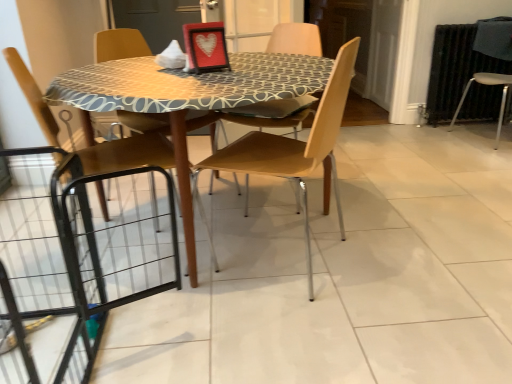
This screenshot has width=512, height=384. What are the coordinates of `wooden chair at center, the second chair positioned from the left` in the screenshot? It's located at (293, 149).

In order to face light brown wood chair at center, the 1th chair when ordered from right to left, should I rotate leftwards or rightwards?

Rotate right and turn 2.709 degrees.

What are the coordinates of `light brown wood chair at center, the 1th chair when ordered from right to left` in the screenshot? It's located at (295, 39).

You are a GUI agent. You are given a task and a screenshot of the screen. Output one action in this format:
    pyautogui.click(x=<x>, y=<y>)
    Task: Click on the matte black picture frame at center
    
    Given the screenshot: What is the action you would take?
    pyautogui.click(x=205, y=47)

From a real-world perspective, is light brown wood chair at center, which is the third chair in left-to-right order, positioned over wooden chair at center, the 2th chair positioned from the right, based on gravity?

Actually, light brown wood chair at center, which is the third chair in left-to-right order, is physically below wooden chair at center, the 2th chair positioned from the right, in the real world.

Does light brown wood chair at center, which is the third chair in left-to-right order, have a greater height compared to wooden chair at center, the 2th chair positioned from the right?

In fact, light brown wood chair at center, which is the third chair in left-to-right order, may be shorter than wooden chair at center, the 2th chair positioned from the right.

Is point (286, 31) positioned in front of point (326, 90)?

No, it is not.

Between light brown wood chair at center, the 1th chair when ordered from right to left, and wooden chair at center, the 2th chair positioned from the right, which one appears on the right side from the viewer's perspective?

light brown wood chair at center, the 1th chair when ordered from right to left.

This screenshot has width=512, height=384. Identify the location of radiator on the right side of transparent glass screen door at center. (455, 69).

Which of these two, black metal radiator at right or transparent glass screen door at center, is bigger?

transparent glass screen door at center is bigger.

Is transparent glass screen door at center inside black metal radiator at right?

Actually, transparent glass screen door at center is outside black metal radiator at right.

Image resolution: width=512 pixels, height=384 pixels. What are the coordinates of `chair that is on the left side of matte black picture frame at center` in the screenshot? It's located at (184, 186).

In terms of width, does matte black picture frame at center look wider or thinner when compared to wooden chair at left, marked as the first chair in a left-to-right arrangement?

Clearly, matte black picture frame at center has less width compared to wooden chair at left, marked as the first chair in a left-to-right arrangement.

Does matte black picture frame at center appear on the right side of wooden chair at left, marked as the first chair in a left-to-right arrangement?

Yes.

Is matte black picture frame at center facing away from wooden chair at left, which is the 3th chair in right-to-left order?

No, matte black picture frame at center is not facing away from wooden chair at left, which is the 3th chair in right-to-left order.

Which is behind, point (307, 51) or point (174, 136)?

The point (307, 51) is farther from the camera.

Based on the photo, which object is wider, light brown wood chair at center, which is the third chair in left-to-right order, or wooden chair at left, marked as the first chair in a left-to-right arrangement?

wooden chair at left, marked as the first chair in a left-to-right arrangement.

From a real-world perspective, does light brown wood chair at center, the 1th chair when ordered from right to left, sit lower than wooden chair at left, marked as the first chair in a left-to-right arrangement?

Correct, in the physical world, light brown wood chair at center, the 1th chair when ordered from right to left, is lower than wooden chair at left, marked as the first chair in a left-to-right arrangement.

In the scene shown: In terms of size, does light brown wood chair at center, which is the third chair in left-to-right order, appear bigger or smaller than wooden chair at left, which is the 3th chair in right-to-left order?

In the image, light brown wood chair at center, which is the third chair in left-to-right order, appears to be larger than wooden chair at left, which is the 3th chair in right-to-left order.

Between wooden chair at left, which is the 3th chair in right-to-left order, and matte black picture frame at center, which one has larger width?

Wider between the two is wooden chair at left, which is the 3th chair in right-to-left order.

Is wooden chair at left, which is the 3th chair in right-to-left order, behind matte black picture frame at center?

No, wooden chair at left, which is the 3th chair in right-to-left order, is closer to the viewer.

The width and height of the screenshot is (512, 384). I want to click on picture frame that is above the wooden chair at left, marked as the first chair in a left-to-right arrangement (from the image's perspective), so click(x=205, y=47).

In the scene shown: In terms of height, does black metal radiator at right look taller or shorter compared to wooden chair at center, the 2th chair positioned from the right?

black metal radiator at right is shorter than wooden chair at center, the 2th chair positioned from the right.

From the image's perspective, relative to wooden chair at center, the 2th chair positioned from the right, is black metal radiator at right above or below?

black metal radiator at right is above wooden chair at center, the 2th chair positioned from the right.

How many degrees apart are the facing directions of black metal radiator at right and wooden chair at center, the 2th chair positioned from the right?

The angle between the facing direction of black metal radiator at right and the facing direction of wooden chair at center, the 2th chair positioned from the right, is 118 degrees.

Does point (469, 31) appear closer or farther from the camera than point (222, 152)?

Point (469, 31) is positioned farther from the camera compared to point (222, 152).

How different are the orientations of black metal radiator at right and matte black picture frame at center in degrees?

black metal radiator at right and matte black picture frame at center are facing 24.3 degrees away from each other.

From a real-world perspective, who is located higher, black metal radiator at right or matte black picture frame at center?

matte black picture frame at center.

Considering the positions of objects black metal radiator at right and matte black picture frame at center in the image provided, who is in front, black metal radiator at right or matte black picture frame at center?

matte black picture frame at center is closer to the camera.

Is black metal radiator at right at the right side of matte black picture frame at center?

Indeed, black metal radiator at right is positioned on the right side of matte black picture frame at center.

From a real-world perspective, starting from the light brown wood chair at center, the 1th chair when ordered from right to left, which chair is the 2nd one vertically above it? Please provide its 2D coordinates.

[(293, 149)]

The width and height of the screenshot is (512, 384). What are the coordinates of `radiator on the right of transparent glass screen door at center` in the screenshot? It's located at (455, 69).

When comparing their distances from matte black picture frame at center, does light brown wood chair at center, the 1th chair when ordered from right to left, or wooden chair at center, the 2th chair positioned from the right, seem closer?

wooden chair at center, the 2th chair positioned from the right, lies closer to matte black picture frame at center than the other object.

Which object lies nearer to the anchor point black metal radiator at right, wooden chair at center, the 2th chair positioned from the right, or light brown wood chair at center, which is the third chair in left-to-right order?

The object closer to black metal radiator at right is light brown wood chair at center, which is the third chair in left-to-right order.

Estimate the real-world distances between objects in this image. Which object is further from matte black picture frame at center, black metal radiator at right or wooden chair at center, the 2th chair positioned from the right?

Based on the image, black metal radiator at right appears to be further to matte black picture frame at center.

Estimate the real-world distances between objects in this image. Which object is closer to black metal radiator at right, wooden chair at left, which is the 3th chair in right-to-left order, or matte black picture frame at center?

Based on the image, matte black picture frame at center appears to be nearer to black metal radiator at right.

Which object lies further to the anchor point matte black picture frame at center, wooden chair at center, the second chair positioned from the left, or wooden chair at left, marked as the first chair in a left-to-right arrangement?

The object further to matte black picture frame at center is wooden chair at left, marked as the first chair in a left-to-right arrangement.

Estimate the real-world distances between objects in this image. Which object is closer to wooden chair at left, which is the 3th chair in right-to-left order, transparent glass screen door at center or matte black picture frame at center?

Among the two, matte black picture frame at center is located nearer to wooden chair at left, which is the 3th chair in right-to-left order.

When comparing their distances from black metal radiator at right, does light brown wood chair at center, the 1th chair when ordered from right to left, or wooden chair at left, which is the 3th chair in right-to-left order, seem closer?

light brown wood chair at center, the 1th chair when ordered from right to left, is closer to black metal radiator at right.

Which object lies further to the anchor point wooden chair at left, marked as the first chair in a left-to-right arrangement, matte black picture frame at center or transparent glass screen door at center?

transparent glass screen door at center is positioned further to the anchor wooden chair at left, marked as the first chair in a left-to-right arrangement.

Locate an element on the screen. The image size is (512, 384). screen door located between wooden chair at left, which is the 3th chair in right-to-left order, and black metal radiator at right in the depth direction is located at coordinates (362, 40).

You are a GUI agent. You are given a task and a screenshot of the screen. Output one action in this format:
    pyautogui.click(x=<x>, y=<y>)
    Task: Click on the picture frame between wooden chair at center, the 2th chair positioned from the right, and transparent glass screen door at center from front to back
    Image resolution: width=512 pixels, height=384 pixels.
    Given the screenshot: What is the action you would take?
    pyautogui.click(x=205, y=47)

The width and height of the screenshot is (512, 384). I want to click on picture frame located between wooden chair at center, the 2th chair positioned from the right, and light brown wood chair at center, which is the third chair in left-to-right order, in the depth direction, so click(x=205, y=47).

This screenshot has height=384, width=512. I want to click on chair between matte black picture frame at center and transparent glass screen door at center in the front-back direction, so click(295, 39).